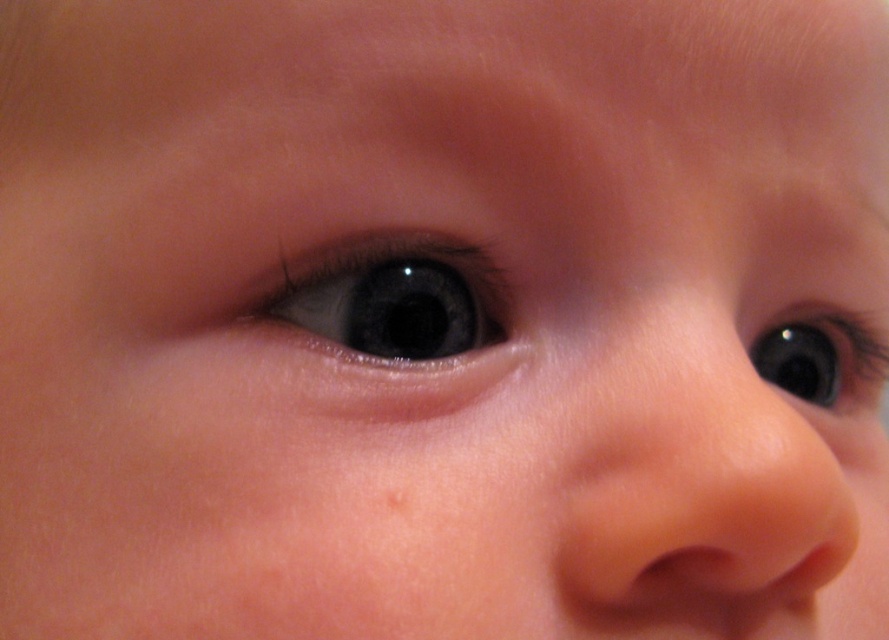
Question: Which object is the farthest from the glossy black eye at upper right?

Choices:
 (A) blue glossy eye at center-left
 (B) smooth flesh-colored nose at center

Answer: (A)

Question: Estimate the real-world distances between objects in this image. Which object is farther from the smooth flesh-colored nose at center?

Choices:
 (A) blue glossy eye at center-left
 (B) glossy black eye at upper right

Answer: (A)

Question: From the image, what is the correct spatial relationship of smooth flesh-colored nose at center in relation to glossy black eye at upper right?

Choices:
 (A) left
 (B) right

Answer: (A)

Question: Which object is farther from the camera taking this photo?

Choices:
 (A) blue glossy eye at center-left
 (B) smooth flesh-colored nose at center
 (C) glossy black eye at upper right

Answer: (C)

Question: Is blue glossy eye at center-left closer to the viewer compared to glossy black eye at upper right?

Choices:
 (A) no
 (B) yes

Answer: (B)

Question: Is the position of smooth flesh-colored nose at center less distant than that of blue glossy eye at center-left?

Choices:
 (A) no
 (B) yes

Answer: (B)